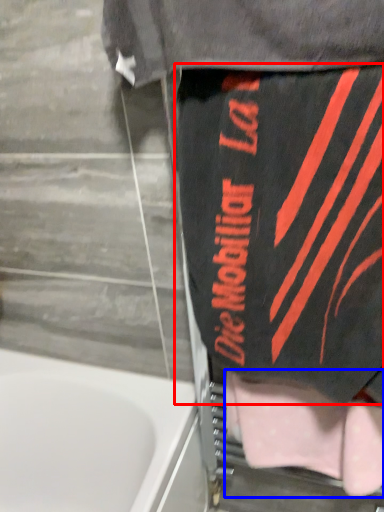
Question: Which point is closer to the camera, underclothes (highlighted by a red box) or towel (highlighted by a blue box)?

Choices:
 (A) underclothes
 (B) towel

Answer: (A)